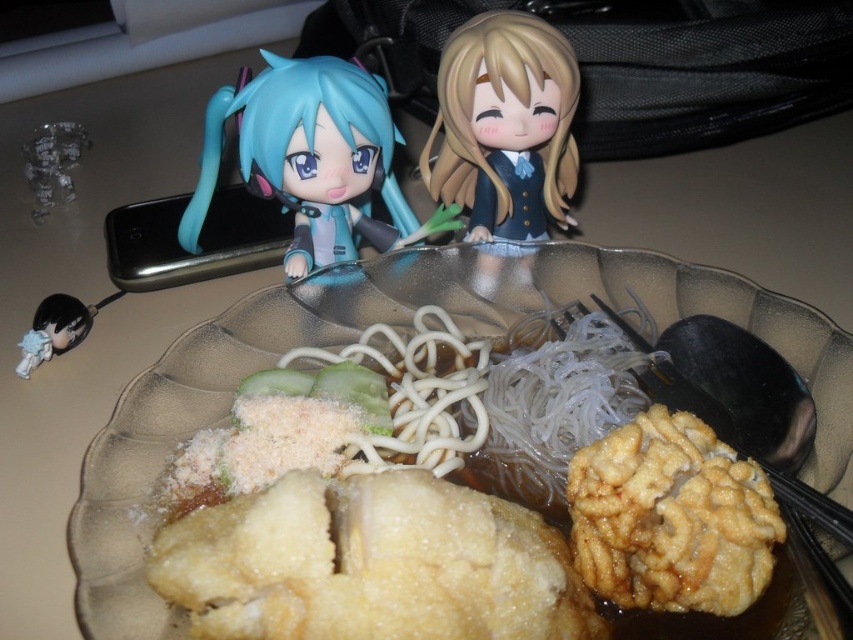
Based on the photo, does matte blue vinyl doll at upper left lie behind blonde hair doll at upper center?

No, matte blue vinyl doll at upper left is in front of blonde hair doll at upper center.

Between point (332, 125) and point (521, 116), which one is positioned in front?

Positioned in front is point (332, 125).

Is point (285, 144) less distant than point (531, 80)?

Yes, point (285, 144) is closer to viewer.

This screenshot has height=640, width=853. Identify the location of matte blue vinyl doll at upper left. (311, 157).

Is translucent glass bowl at center taller than white glossy noodles at center?

Yes.

Does translucent glass bowl at center appear on the left side of white glossy noodles at center?

No, translucent glass bowl at center is not to the left of white glossy noodles at center.

Measure the distance between translucent glass bowl at center and camera.

They are 13.30 inches apart.

What are the coordinates of `translucent glass bowl at center` in the screenshot? It's located at (399, 326).

Does golden crispy fried chicken at center have a lesser height compared to matte blue vinyl doll at upper left?

Yes, golden crispy fried chicken at center is shorter than matte blue vinyl doll at upper left.

Between point (691, 540) and point (351, 241), which one is positioned in front?

Point (691, 540)

What do you see at coordinates (671, 516) in the screenshot? The image size is (853, 640). I see `golden crispy fried chicken at center` at bounding box center [671, 516].

Where is `golden crispy fried chicken at center`? golden crispy fried chicken at center is located at coordinates (671, 516).